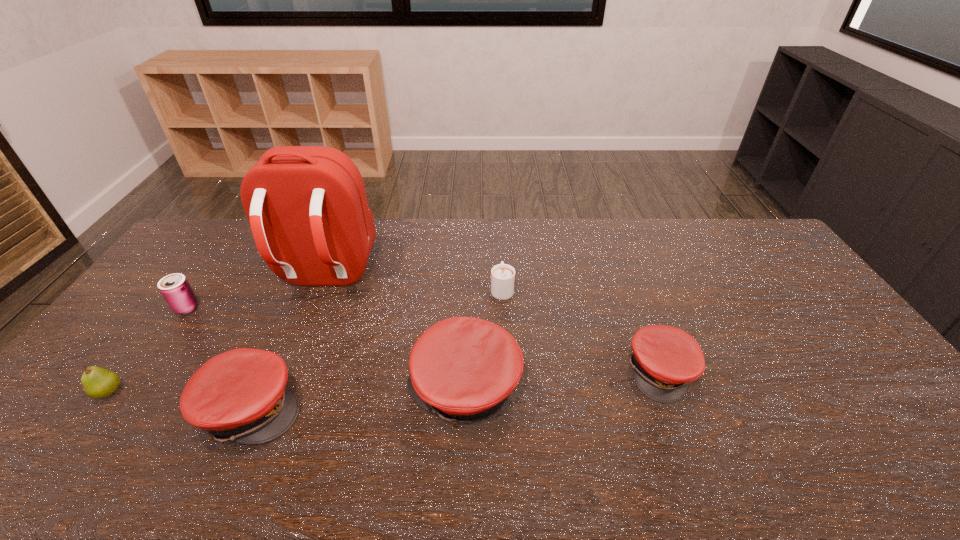
Where is `vacant area between the cappuccino and the second shortest cap`? The height and width of the screenshot is (540, 960). vacant area between the cappuccino and the second shortest cap is located at coordinates tap(377, 348).

The width and height of the screenshot is (960, 540). Identify the location of vacant space in between the tallest object and the pear. (217, 334).

Image resolution: width=960 pixels, height=540 pixels. In order to click on vacant area that lies between the pear and the can in this screenshot , I will do `click(148, 349)`.

The width and height of the screenshot is (960, 540). In order to click on unoccupied area between the cappuccino and the leftmost cap in this screenshot , I will do `click(377, 348)`.

This screenshot has width=960, height=540. I want to click on blank region between the pear and the can, so coord(148,349).

Locate an element on the screen. This screenshot has height=540, width=960. free space between the cappuccino and the can is located at coordinates (345, 298).

The width and height of the screenshot is (960, 540). What are the coordinates of `object that stands as the sixth closest to the second cap from right to left` in the screenshot? It's located at (98, 383).

Point out which object is positioned as the third nearest to the tallest cap. Please provide its 2D coordinates. Your answer should be formatted as a tuple, i.e. [(x, y)], where the tuple contains the x and y coordinates of a point satisfying the conditions above.

[(241, 395)]

Identify which cap is located as the second nearest to the rightmost object. Please provide its 2D coordinates. Your answer should be formatted as a tuple, i.e. [(x, y)], where the tuple contains the x and y coordinates of a point satisfying the conditions above.

[(241, 395)]

Where is `the closest cap to the can`? This screenshot has width=960, height=540. the closest cap to the can is located at coordinates (241, 395).